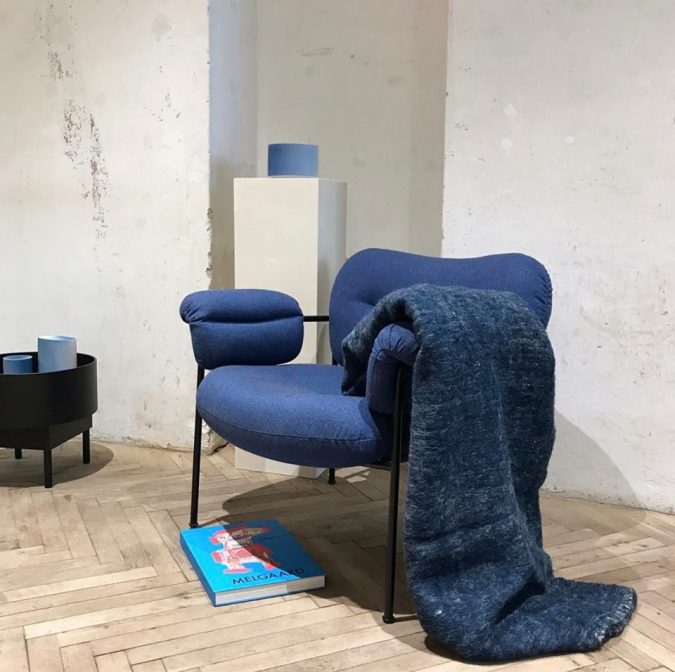
What are the coordinates of `blanket` in the screenshot? It's located at (481, 485).